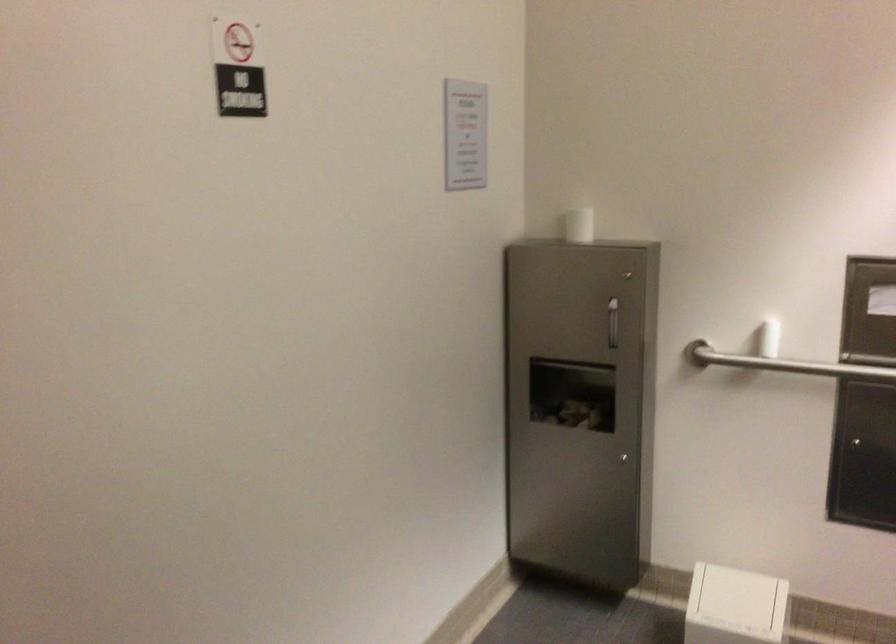
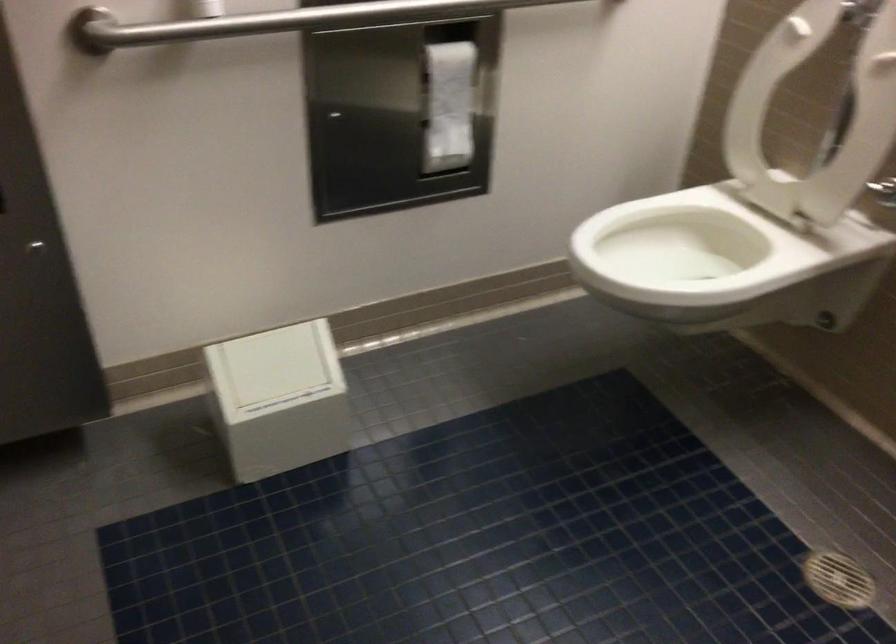
Locate, in the second image, the point that corresponds to point 800,362 in the first image.

(279, 21)